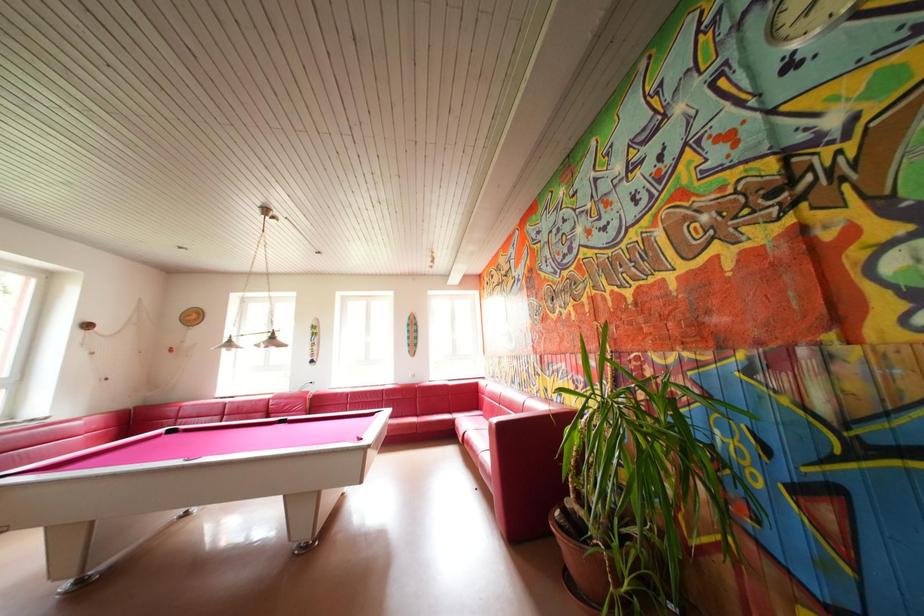
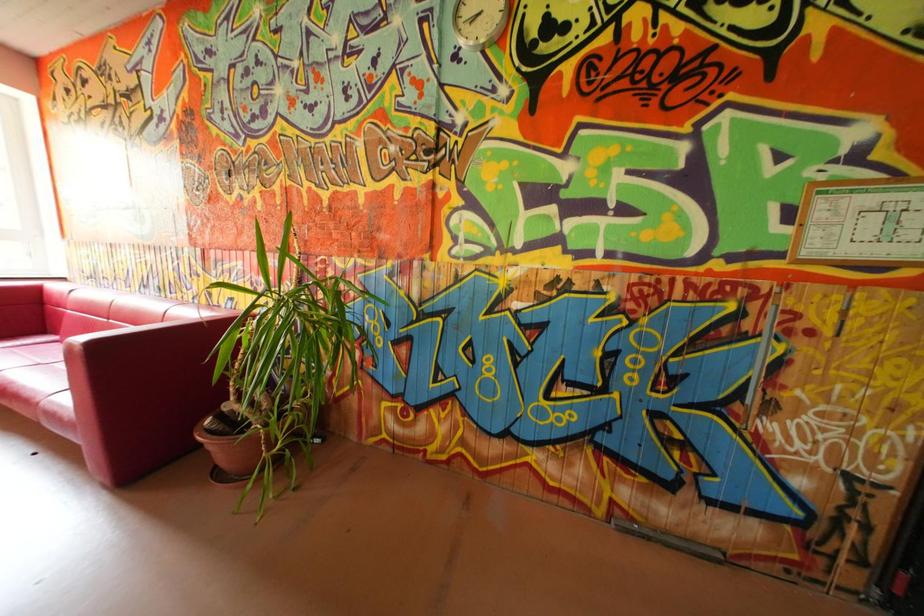
Question: The camera is either moving clockwise (left) or counter-clockwise (right) around the object. The first image is from the beginning of the video and the second image is from the end. Is the camera moving left or right when shooting the video?

Choices:
 (A) Left
 (B) Right

Answer: (A)